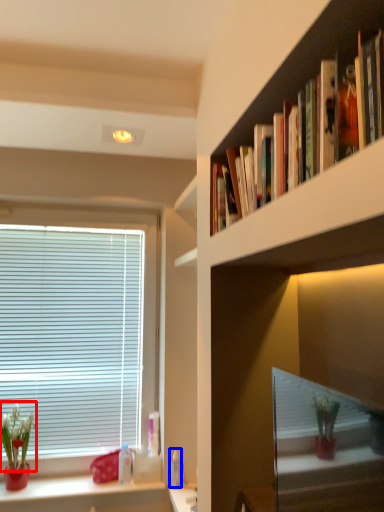
Question: Which object appears closest to the camera in this image, floral arrangement (highlighted by a red box) or toiletry (highlighted by a blue box)?

Choices:
 (A) floral arrangement
 (B) toiletry

Answer: (A)